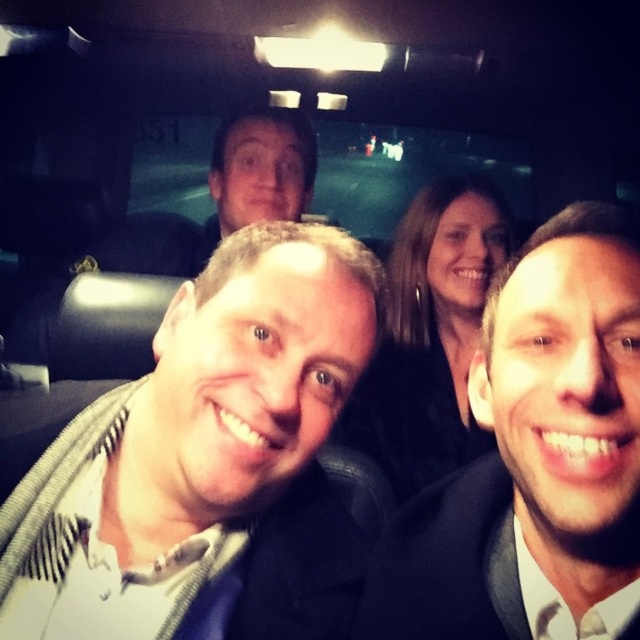
Question: Is matte black suit at center wider than dark brown hair at center?

Choices:
 (A) yes
 (B) no

Answer: (B)

Question: Considering the relative positions of white textured shirt at center and dark brown hair at center in the image provided, where is white textured shirt at center located with respect to dark brown hair at center?

Choices:
 (A) right
 (B) left

Answer: (B)

Question: Is the position of white textured shirt at center more distant than that of matte black suit at center?

Choices:
 (A) no
 (B) yes

Answer: (B)

Question: Among these objects, which one is nearest to the camera?

Choices:
 (A) white textured shirt at center
 (B) matte black suit at center
 (C) smooth skin face at upper center
 (D) dark brown hair at center

Answer: (B)

Question: Which object is the farthest from the smooth skin face at upper center?

Choices:
 (A) white textured shirt at center
 (B) dark brown hair at center

Answer: (A)

Question: Based on their relative distances, which object is nearer to the matte black suit at center?

Choices:
 (A) white textured shirt at center
 (B) dark brown hair at center
 (C) smooth skin face at upper center

Answer: (A)